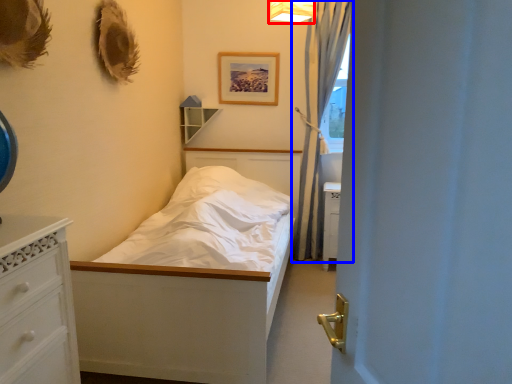
Question: Which point is closer to the camera, light fixture (highlighted by a red box) or curtain (highlighted by a blue box)?

Choices:
 (A) light fixture
 (B) curtain

Answer: (A)